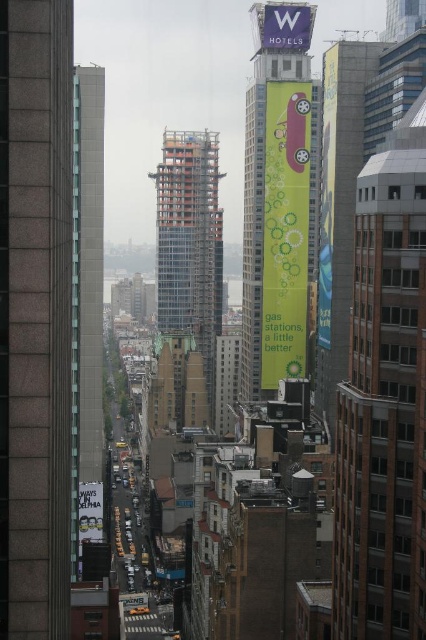
You are a city planner assessing the proposed placement of a new 100m tall communication tower. The tower must be at least 150 meters away from any existing structures to comply with safety regulations. Given the distance between the gray concrete skyscraper at center and the green fabric banner at center, would the proposed tower placement between them violate safety regulations?

The gray concrete skyscraper at center and green fabric banner at center are 124.61 meters apart. Since the proposed tower placement between them would be within 124.61 meters of both structures, which is less than the required 150 meters, this placement would violate safety regulations.

From the picture: You are a city planner reviewing this urban layout. You notice a gray concrete skyscraper at center located at point [46,308]. How does its height compare to the surrounding buildings in the scene?

The gray concrete skyscraper at center located at point [46,308] is taller than the surrounding buildings.